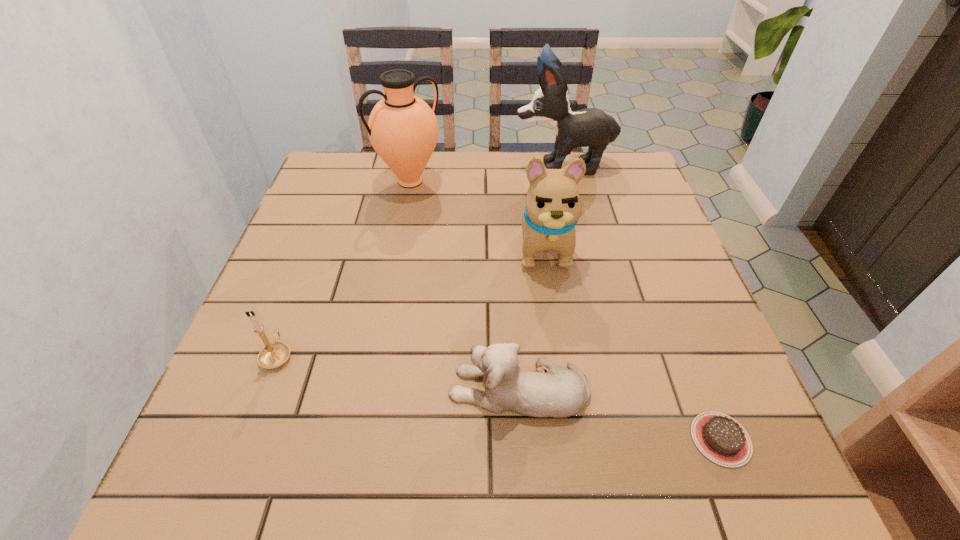
You are a GUI agent. You are given a task and a screenshot of the screen. Output one action in this format:
    pyautogui.click(x=<x>, y=<y>)
    Task: Click on the vacant space located 0.070m on the right of the fifth object from right to left
    
    Given the screenshot: What is the action you would take?
    pyautogui.click(x=468, y=181)

Locate an element on the screen. free space located on the face of the second farthest puppy is located at coordinates (570, 423).

You are a GUI agent. You are given a task and a screenshot of the screen. Output one action in this format:
    pyautogui.click(x=<x>, y=<y>)
    Task: Click on the vacant region located on the handle side of the candle holder
    Image resolution: width=960 pixels, height=540 pixels.
    Given the screenshot: What is the action you would take?
    pyautogui.click(x=324, y=231)

Image resolution: width=960 pixels, height=540 pixels. Identify the location of free space located on the handle side of the candle holder. coord(328,220).

Where is `blank space located 0.370m on the handle side of the candle holder`? blank space located 0.370m on the handle side of the candle holder is located at coordinates (328, 220).

Find the location of a particular element. This screenshot has width=960, height=540. vacant space located on the front-facing side of the shortest puppy is located at coordinates (292, 389).

Where is `free space located on the front-facing side of the shortest puppy`? The image size is (960, 540). free space located on the front-facing side of the shortest puppy is located at coordinates (225, 389).

You are a GUI agent. You are given a task and a screenshot of the screen. Output one action in this format:
    pyautogui.click(x=<x>, y=<y>)
    Task: Click on the free spot located 0.250m on the front-facing side of the shortest puppy
    This screenshot has height=540, width=960.
    Given the screenshot: What is the action you would take?
    pyautogui.click(x=309, y=389)

Locate an element on the screen. The width and height of the screenshot is (960, 540). free location located on the left of the chocolate cake is located at coordinates (559, 439).

Identify the location of puppy that is at the far edge. The width and height of the screenshot is (960, 540). (591, 127).